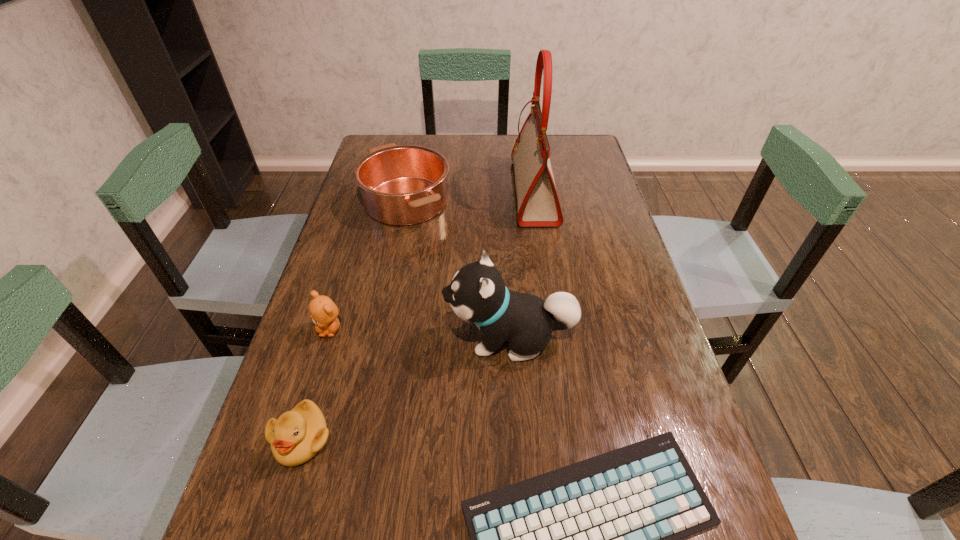
You are a GUI agent. You are given a task and a screenshot of the screen. Output one action in this format:
    pyautogui.click(x=<x>, y=<y>)
    Task: Click on the vacant space located on the face of the teddy bear
    Image resolution: width=960 pixels, height=540 pixels.
    Given the screenshot: What is the action you would take?
    pyautogui.click(x=304, y=414)

You are a GUI agent. You are given a task and a screenshot of the screen. Output one action in this format:
    pyautogui.click(x=<x>, y=<y>)
    Task: Click on the free location located on the front-facing side of the fifth tallest object
    Image resolution: width=960 pixels, height=540 pixels.
    Given the screenshot: What is the action you would take?
    pyautogui.click(x=284, y=499)

This screenshot has width=960, height=540. I want to click on object that is positioned at the far edge, so click(x=538, y=204).

At what (x,y) coordinates should I click in order to perform the action: click on saucepan positioned at the left edge. Please return your answer as a coordinate pair (x, y). Looking at the image, I should click on (401, 185).

This screenshot has height=540, width=960. I want to click on teddy bear present at the left edge, so click(x=323, y=311).

At what (x,y) coordinates should I click in order to perform the action: click on duckling that is at the left edge. Please return your answer as a coordinate pair (x, y). The width and height of the screenshot is (960, 540). Looking at the image, I should click on (298, 435).

The height and width of the screenshot is (540, 960). What are the coordinates of `free spot at the far edge of the desktop` in the screenshot? It's located at (490, 137).

You are a GUI agent. You are given a task and a screenshot of the screen. Output one action in this format:
    pyautogui.click(x=<x>, y=<y>)
    Task: Click on the vacant space at the left edge of the desktop
    
    Given the screenshot: What is the action you would take?
    pyautogui.click(x=325, y=461)

Locate an element on the screen. The width and height of the screenshot is (960, 540). vacant region at the right edge is located at coordinates (655, 430).

Image resolution: width=960 pixels, height=540 pixels. I want to click on free space at the far right corner, so click(554, 138).